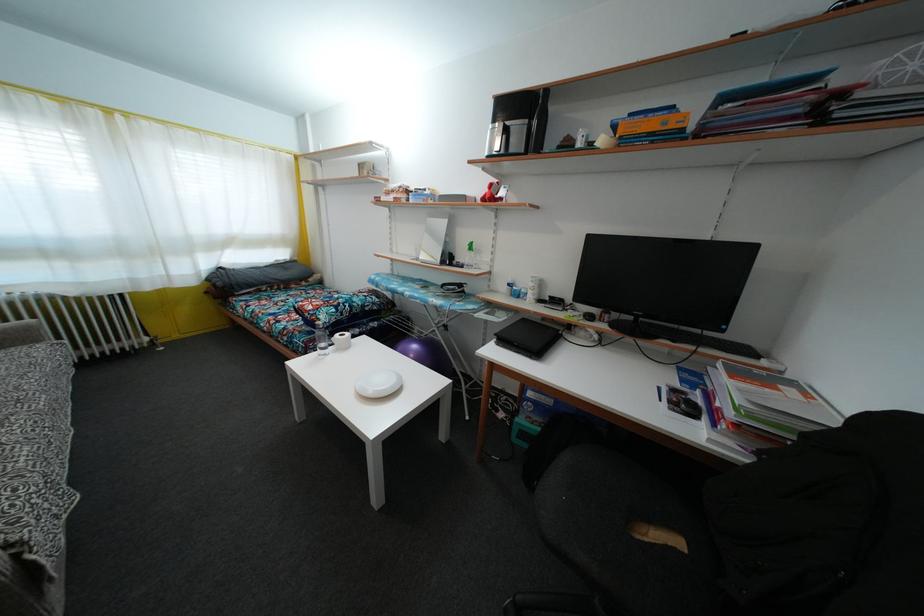
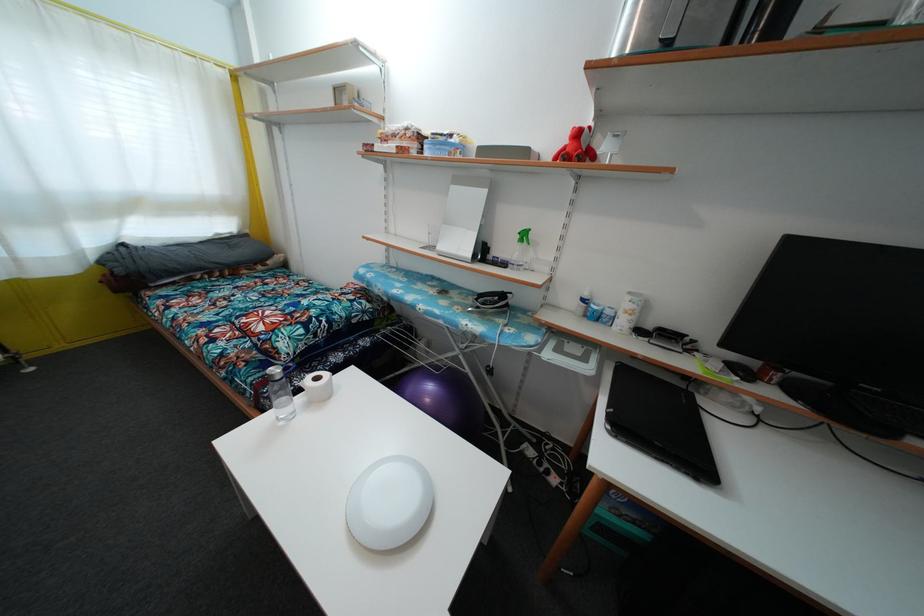
Locate, in the second image, the point that corresponds to (x=451, y=216) in the first image.

(488, 177)